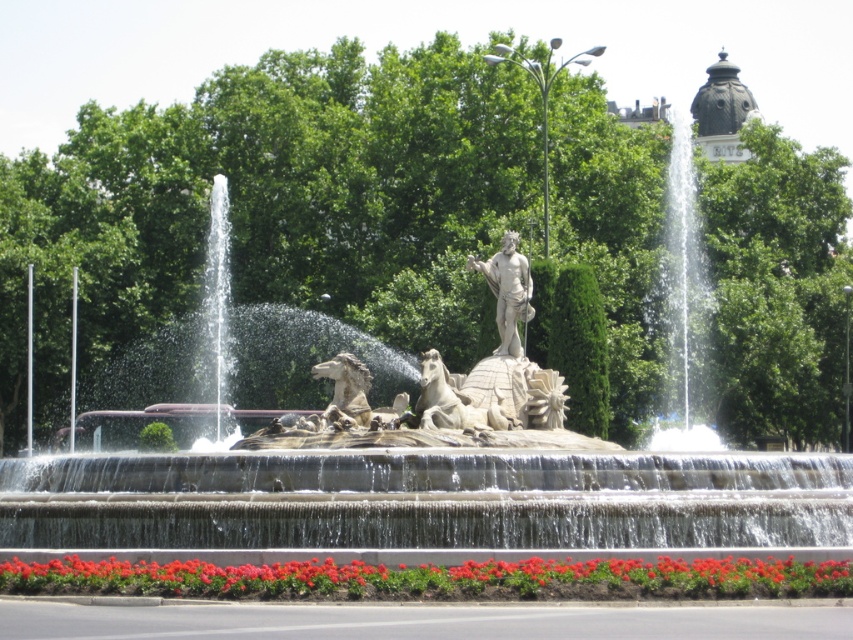
Question: Can you confirm if stone fountain at center is positioned below polished stone horse at center?

Choices:
 (A) yes
 (B) no

Answer: (B)

Question: Among these objects, which one is farthest from the camera?

Choices:
 (A) polished bronze statue at center
 (B) red glossy flowers at lower center
 (C) stone fountain at center

Answer: (A)

Question: Can you confirm if stone fountain at center is positioned to the right of polished stone horse at center?

Choices:
 (A) no
 (B) yes

Answer: (B)

Question: Which of these objects is positioned farthest from the red glossy flowers at lower center?

Choices:
 (A) polished stone horse at center
 (B) polished bronze statue at center

Answer: (B)

Question: Which object is farther from the camera taking this photo?

Choices:
 (A) polished stone horse at center
 (B) red glossy flowers at lower center

Answer: (A)

Question: Does stone fountain at center have a smaller size compared to polished bronze statue at center?

Choices:
 (A) yes
 (B) no

Answer: (B)